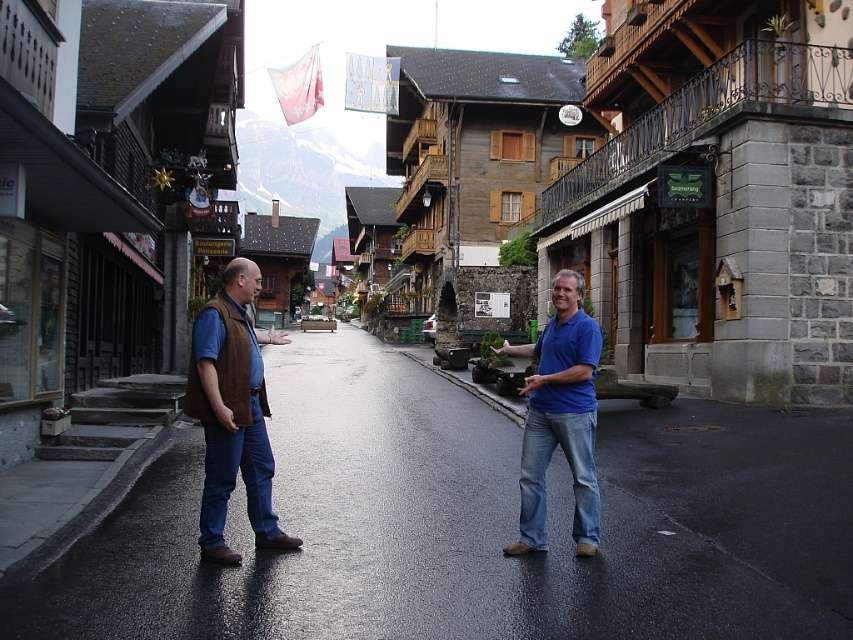
You are a photographer standing 3 meters away from the brown suede vest at left. You want to take a photo of the camera without moving. Is the camera within your reach? Please explain.

The brown suede vest at left and camera are 5.00 meters apart from each other. Since you are 3 meters away from the brown suede vest at left, the camera is 5.00 meters away from you. Therefore, the camera is 2 meters further away than your current position, so it is out of reach without moving.

You are a tourist in the village and want to take a photo of both the brown suede vest at center and the brown suede vest at left. Which one should you focus on first to ensure they are both in frame?

The brown suede vest at center is much taller than the brown suede vest at left, so you should focus on the brown suede vest at center first to ensure both are in frame.